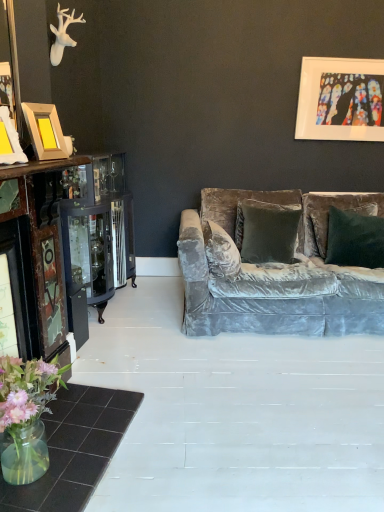
Question: Would you say translucent glass vase at lower left contains velvet green pillow at center?

Choices:
 (A) yes
 (B) no

Answer: (B)

Question: Are translucent glass vase at lower left and velvet green pillow at center far apart?

Choices:
 (A) no
 (B) yes

Answer: (B)

Question: Can you confirm if translucent glass vase at lower left is smaller than velvet green pillow at center?

Choices:
 (A) no
 (B) yes

Answer: (B)

Question: Is velvet green pillow at center at the back of translucent glass vase at lower left?

Choices:
 (A) no
 (B) yes

Answer: (A)

Question: Considering the relative positions of translucent glass vase at lower left and velvet green pillow at center in the image provided, is translucent glass vase at lower left to the left of velvet green pillow at center from the viewer's perspective?

Choices:
 (A) yes
 (B) no

Answer: (A)

Question: Is velvet green pillow at center inside the boundaries of translucent glass vase at lower left, or outside?

Choices:
 (A) outside
 (B) inside

Answer: (A)

Question: Considering the positions of velvet green pillow at center and translucent glass vase at lower left in the image, is velvet green pillow at center taller or shorter than translucent glass vase at lower left?

Choices:
 (A) tall
 (B) short

Answer: (A)

Question: Would you say velvet green pillow at center is to the left or to the right of translucent glass vase at lower left in the picture?

Choices:
 (A) right
 (B) left

Answer: (A)

Question: Is velvet green pillow at center bigger or smaller than translucent glass vase at lower left?

Choices:
 (A) small
 (B) big

Answer: (B)

Question: From a real-world perspective, is velvet green pillow at center physically located above or below stained glass artwork at upper right, which ranks as the 2th picture frame in bottom-to-top order?

Choices:
 (A) above
 (B) below

Answer: (B)

Question: Relative to stained glass artwork at upper right, the 1th picture frame in the right-to-left sequence, is velvet green pillow at center in front or behind?

Choices:
 (A) front
 (B) behind

Answer: (A)

Question: In the image, is velvet green pillow at center on the left side or the right side of stained glass artwork at upper right, positioned as the first picture frame in top-to-bottom order?

Choices:
 (A) left
 (B) right

Answer: (A)

Question: Considering the positions of point (355, 215) and point (299, 79), is point (355, 215) closer or farther from the camera than point (299, 79)?

Choices:
 (A) farther
 (B) closer

Answer: (B)

Question: From a real-world perspective, is stained glass artwork at upper right, positioned as the first picture frame in top-to-bottom order, physically located above or below velvet green pillow at center?

Choices:
 (A) above
 (B) below

Answer: (A)

Question: Looking at the image, does stained glass artwork at upper right, the 2th picture frame in the front-to-back sequence, seem bigger or smaller compared to velvet green pillow at center?

Choices:
 (A) small
 (B) big

Answer: (A)